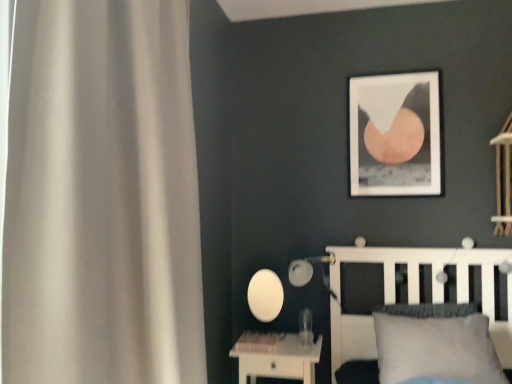
The image size is (512, 384). Describe the element at coordinates (275, 357) in the screenshot. I see `white glossy nightstand at lower center` at that location.

Measure the distance between point (407, 259) and camera.

They are 7.79 feet apart.

The height and width of the screenshot is (384, 512). Find the location of `white matte bed at lower right`. white matte bed at lower right is located at coordinates (413, 291).

The height and width of the screenshot is (384, 512). Identify the location of white glossy nightstand at lower center. (275, 357).

Considering the positions of objects white matte curtain at left and white glossy nightstand at lower center in the image provided, who is behind, white matte curtain at left or white glossy nightstand at lower center?

white glossy nightstand at lower center.

How much distance is there between white matte curtain at left and white glossy nightstand at lower center?

A distance of 4.27 feet exists between white matte curtain at left and white glossy nightstand at lower center.

Considering the relative sizes of white matte curtain at left and white glossy nightstand at lower center in the image provided, is white matte curtain at left wider than white glossy nightstand at lower center?

No, white matte curtain at left is not wider than white glossy nightstand at lower center.

Locate an element on the screen. This screenshot has height=384, width=512. nightstand below the white matte curtain at left (from the image's perspective) is located at coordinates (275, 357).

Is white soft pillow at lower right behind white glossy nightstand at lower center?

No, the depth of white soft pillow at lower right is less than that of white glossy nightstand at lower center.

Is white soft pillow at lower right positioned beyond the bounds of white glossy nightstand at lower center?

white soft pillow at lower right lies outside white glossy nightstand at lower center's area.

Considering the positions of point (423, 337) and point (266, 339), is point (423, 337) closer or farther from the camera than point (266, 339)?

Point (423, 337) appears to be closer to the viewer than point (266, 339).

Consider the image. Can you confirm if white soft pillow at lower right is bigger than white matte curtain at left?

No, white soft pillow at lower right is not bigger than white matte curtain at left.

Find the location of a particular element. pillow beneath the white matte curtain at left (from a real-world perspective) is located at coordinates (435, 343).

Between white soft pillow at lower right and white matte curtain at left, which one is positioned in front?

Positioned in front is white matte curtain at left.

How many degrees apart are the facing directions of white soft pillow at lower right and white matte curtain at left?

The angular difference between white soft pillow at lower right and white matte curtain at left is 86.9 degrees.

From a real-world perspective, does white glossy nightstand at lower center sit lower than white soft pillow at lower right?

Yes.

Considering the relative positions of white glossy nightstand at lower center and white soft pillow at lower right in the image provided, is white glossy nightstand at lower center to the left of white soft pillow at lower right from the viewer's perspective?

Yes, white glossy nightstand at lower center is to the left of white soft pillow at lower right.

Is white glossy nightstand at lower center thinner than white soft pillow at lower right?

In fact, white glossy nightstand at lower center might be wider than white soft pillow at lower right.

Image resolution: width=512 pixels, height=384 pixels. I want to click on pillow on the right of white matte picture frame at upper center, so click(435, 343).

From the image's perspective, is white matte picture frame at upper center above or below white soft pillow at lower right?

Clearly, from the image's perspective, white matte picture frame at upper center is above white soft pillow at lower right.

Would you say white matte picture frame at upper center is to the left or to the right of white soft pillow at lower right in the picture?

white matte picture frame at upper center is positioned on white soft pillow at lower right's left side.

How many degrees apart are the facing directions of white matte picture frame at upper center and white soft pillow at lower right?

4.07 degrees separate the facing orientations of white matte picture frame at upper center and white soft pillow at lower right.

From a real-world perspective, which is physically below, white soft pillow at lower right or matte white table lamp at center?

From a 3D spatial view, white soft pillow at lower right is below.

Consider the image. Considering the positions of objects white soft pillow at lower right and matte white table lamp at center in the image provided, who is in front, white soft pillow at lower right or matte white table lamp at center?

white soft pillow at lower right.

From the image's perspective, is white soft pillow at lower right above matte white table lamp at center?

No.

How different are the orientations of white soft pillow at lower right and matte white table lamp at center in degrees?

white soft pillow at lower right and matte white table lamp at center are facing 1.92 degrees away from each other.

Is white matte bed at lower right in contact with white soft pillow at lower right?

There is a gap between white matte bed at lower right and white soft pillow at lower right.

From a real-world perspective, which is physically above, white matte bed at lower right or white soft pillow at lower right?

In real-world perspective, white matte bed at lower right is above.

Choose the correct answer: Is white matte bed at lower right inside white soft pillow at lower right or outside it?

The correct answer is: outside.

The width and height of the screenshot is (512, 384). What are the coordinates of `pillow that is below the white matte bed at lower right (from the image's perspective)` in the screenshot? It's located at (435, 343).

Identify the location of nightstand behind the white matte curtain at left. (275, 357).

Where is `pillow in front of the white glossy nightstand at lower center`? pillow in front of the white glossy nightstand at lower center is located at coordinates (435, 343).

From the image, which object appears to be nearer to white soft pillow at lower right, matte white table lamp at center or white matte curtain at left?

matte white table lamp at center lies closer to white soft pillow at lower right than the other object.

From the image, which object appears to be nearer to white matte bed at lower right, matte white table lamp at center or white matte picture frame at upper center?

matte white table lamp at center is closer to white matte bed at lower right.

Estimate the real-world distances between objects in this image. Which object is further from white soft pillow at lower right, white matte picture frame at upper center or matte white table lamp at center?

white matte picture frame at upper center is positioned further to the anchor white soft pillow at lower right.

Looking at the image, which one is located closer to white glossy nightstand at lower center, white matte curtain at left or white matte picture frame at upper center?

white matte picture frame at upper center is closer to white glossy nightstand at lower center.

Looking at the image, which one is located further to matte white table lamp at center, white soft pillow at lower right or white matte curtain at left?

white matte curtain at left.

When comparing their distances from white glossy nightstand at lower center, does white matte picture frame at upper center or white matte curtain at left seem further?

white matte curtain at left is further to white glossy nightstand at lower center.

Considering their positions, is white matte bed at lower right positioned closer to white matte curtain at left than white soft pillow at lower right?

white soft pillow at lower right.

Based on the photo, from the image, which object appears to be nearer to white matte picture frame at upper center, matte white table lamp at center or white matte bed at lower right?

white matte bed at lower right is positioned closer to the anchor white matte picture frame at upper center.

Image resolution: width=512 pixels, height=384 pixels. Identify the location of table lamp between white matte picture frame at upper center and white glossy nightstand at lower center in the up-down direction. (310, 272).

Where is `pillow located between white matte curtain at left and matte white table lamp at center in the depth direction`? This screenshot has height=384, width=512. pillow located between white matte curtain at left and matte white table lamp at center in the depth direction is located at coordinates (435, 343).

This screenshot has height=384, width=512. In order to click on pillow between white matte picture frame at upper center and white glossy nightstand at lower center vertically in this screenshot , I will do `click(435, 343)`.

Where is `nightstand between white matte bed at lower right and matte white table lamp at center from front to back`? The image size is (512, 384). nightstand between white matte bed at lower right and matte white table lamp at center from front to back is located at coordinates (275, 357).